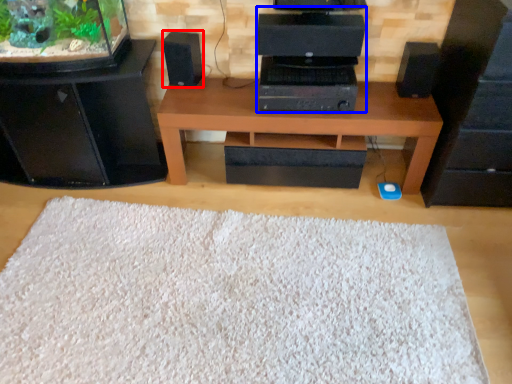
Question: Which of the following is the farthest to the observer, speaker (highlighted by a red box) or computer (highlighted by a blue box)?

Choices:
 (A) speaker
 (B) computer

Answer: (A)